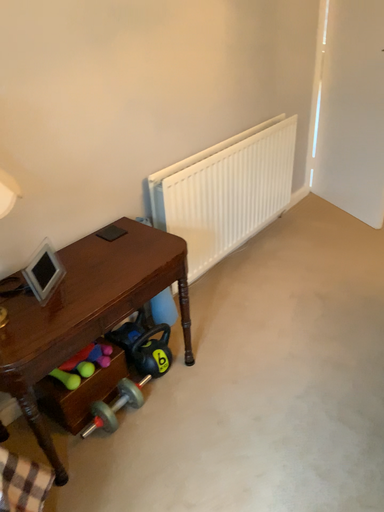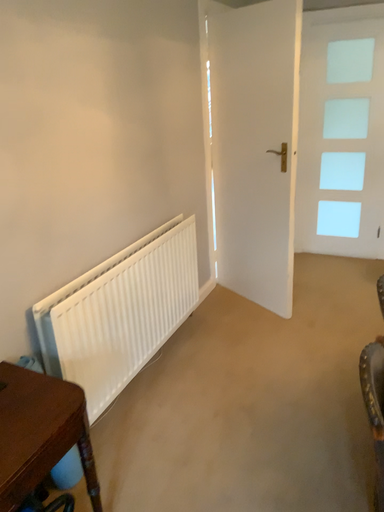
Question: Which way did the camera rotate in the video?

Choices:
 (A) rotated left
 (B) rotated right

Answer: (B)